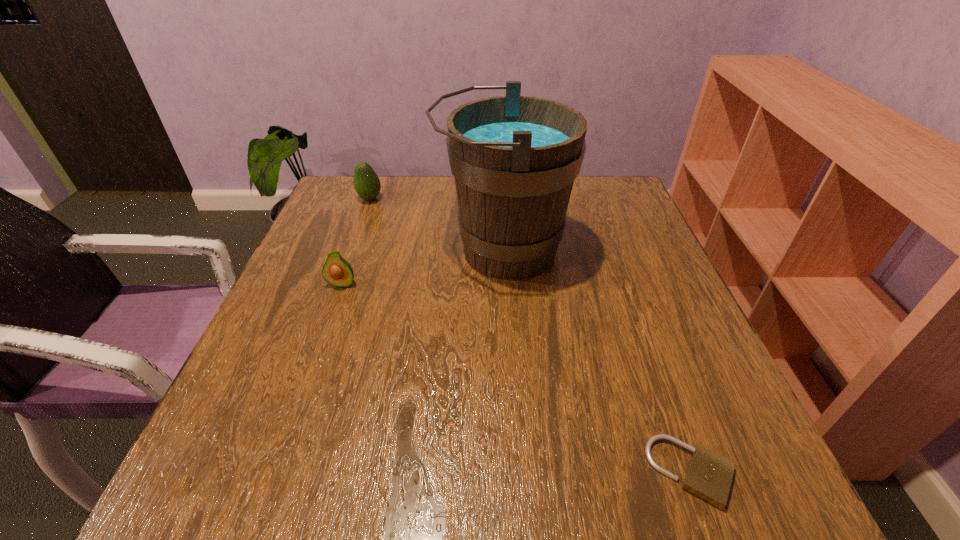
The image size is (960, 540). Find the location of `vacant space that satisfies the following two spatial constraints: 1. with a handle on the side of the second object from right to left; 2. on the right side of the shortest object`. vacant space that satisfies the following two spatial constraints: 1. with a handle on the side of the second object from right to left; 2. on the right side of the shortest object is located at coordinates (516, 472).

Locate an element on the screen. The width and height of the screenshot is (960, 540). blank area in the image that satisfies the following two spatial constraints: 1. on the cut side of the shortest object; 2. on the left side of the nearer avocado is located at coordinates (276, 472).

The width and height of the screenshot is (960, 540). I want to click on free space in the image that satisfies the following two spatial constraints: 1. with a handle on the side of the wine bucket; 2. on the back side of the nearest object, so click(x=516, y=472).

Where is `vacant area that satisfies the following two spatial constraints: 1. with a handle on the side of the nearest object; 2. on the right side of the tallest object`? vacant area that satisfies the following two spatial constraints: 1. with a handle on the side of the nearest object; 2. on the right side of the tallest object is located at coordinates (516, 472).

Where is `free location that satisfies the following two spatial constraints: 1. on the front side of the farthest object; 2. on the left side of the padlock`? This screenshot has height=540, width=960. free location that satisfies the following two spatial constraints: 1. on the front side of the farthest object; 2. on the left side of the padlock is located at coordinates (272, 472).